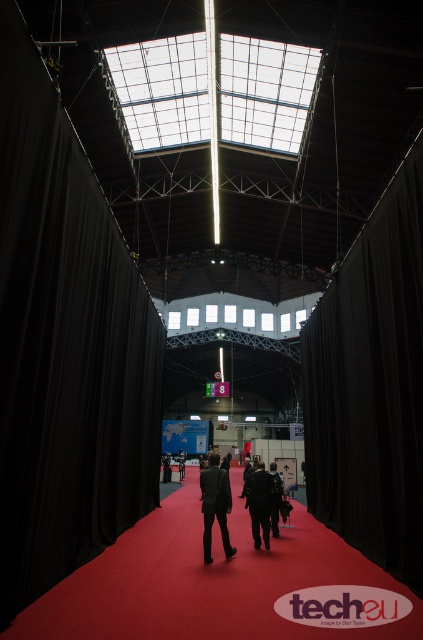
Question: Among these points, which one is nearest to the camera?

Choices:
 (A) (269, 486)
 (B) (209, 513)

Answer: (B)

Question: Which of the following is the farthest from the observer?

Choices:
 (A) (224, 550)
 (B) (277, 486)

Answer: (B)

Question: Can you confirm if dark suit at center is positioned above black matte suit at center?

Choices:
 (A) yes
 (B) no

Answer: (B)

Question: Is black fabric curtain at left bigger than dark suit at center?

Choices:
 (A) no
 (B) yes

Answer: (B)

Question: Which of these objects is positioned closest to the dark gray suit at center?

Choices:
 (A) black fabric curtain at left
 (B) black matte suit at center
 (C) black fabric curtain at right

Answer: (B)

Question: Considering the relative positions of dark suit at center and dark gray suit at center in the image provided, where is dark suit at center located with respect to dark gray suit at center?

Choices:
 (A) left
 (B) right

Answer: (A)